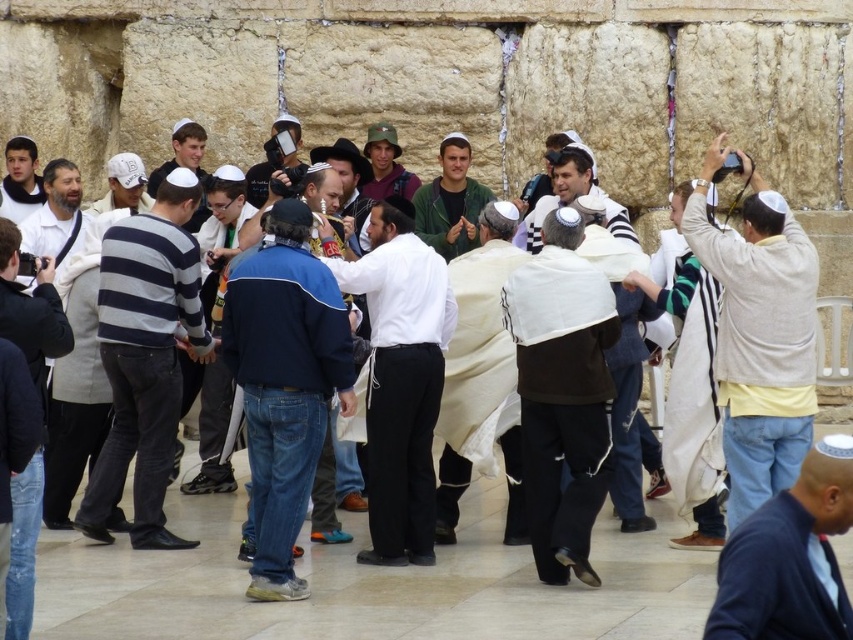
Question: Which of the following is the farthest from the observer?

Choices:
 (A) white matte shirt at center
 (B) white fabric shawl at center
 (C) light beige sweater at right
 (D) matte green sweater at center

Answer: (D)

Question: Which of the following is the closest to the observer?

Choices:
 (A) (120, 180)
 (B) (36, 196)

Answer: (A)

Question: Which object is positioned farthest from the striped cotton sweater at left?

Choices:
 (A) matte white vest at center
 (B) camouflage fabric hat at center

Answer: (B)

Question: Is blue fleece jacket at center wider than matte black camera at center?

Choices:
 (A) yes
 (B) no

Answer: (A)

Question: Is striped cotton sweater at left positioned in front of white matte baseball cap at upper left?

Choices:
 (A) yes
 (B) no

Answer: (A)

Question: Does matte white sweater at center appear under camouflage fabric hat at center?

Choices:
 (A) yes
 (B) no

Answer: (A)